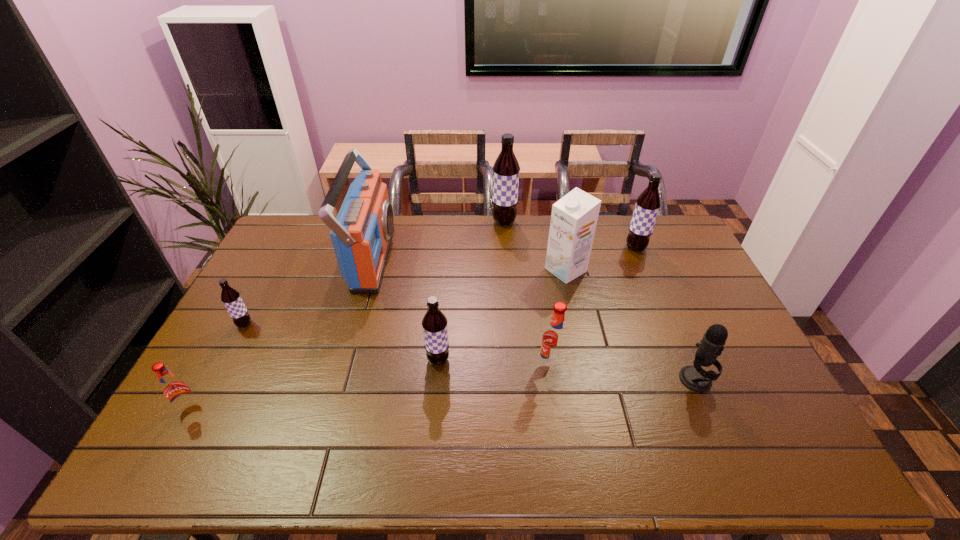
Where is `the third brown root beer from left to right`? The image size is (960, 540). the third brown root beer from left to right is located at coordinates (506, 168).

This screenshot has width=960, height=540. Find the location of `the farthest brown root beer`. the farthest brown root beer is located at coordinates (506, 168).

You are a GUI agent. You are given a task and a screenshot of the screen. Output one action in this format:
    pyautogui.click(x=<x>, y=<y>)
    Task: Click on the radio receiver
    
    Given the screenshot: What is the action you would take?
    pyautogui.click(x=361, y=234)

You are a GUI agent. You are given a task and a screenshot of the screen. Output one action in this format:
    pyautogui.click(x=<x>, y=<y>)
    Task: Click on the blue radio receiver
    
    Given the screenshot: What is the action you would take?
    pyautogui.click(x=361, y=234)

Where is `the fifth shortest root beer`? the fifth shortest root beer is located at coordinates (x=648, y=203).

Find the location of a particular element. The height and width of the screenshot is (540, 960). the fifth nearest root beer is located at coordinates (648, 203).

This screenshot has width=960, height=540. Find the location of `carton`. carton is located at coordinates (574, 217).

Find the location of `the second brown root beer from left to right`. the second brown root beer from left to right is located at coordinates (434, 323).

This screenshot has height=540, width=960. Find the location of `the sixth object from right to left`. the sixth object from right to left is located at coordinates (434, 323).

Locate an element on the screen. The height and width of the screenshot is (540, 960). the fifth root beer from left to right is located at coordinates (554, 341).